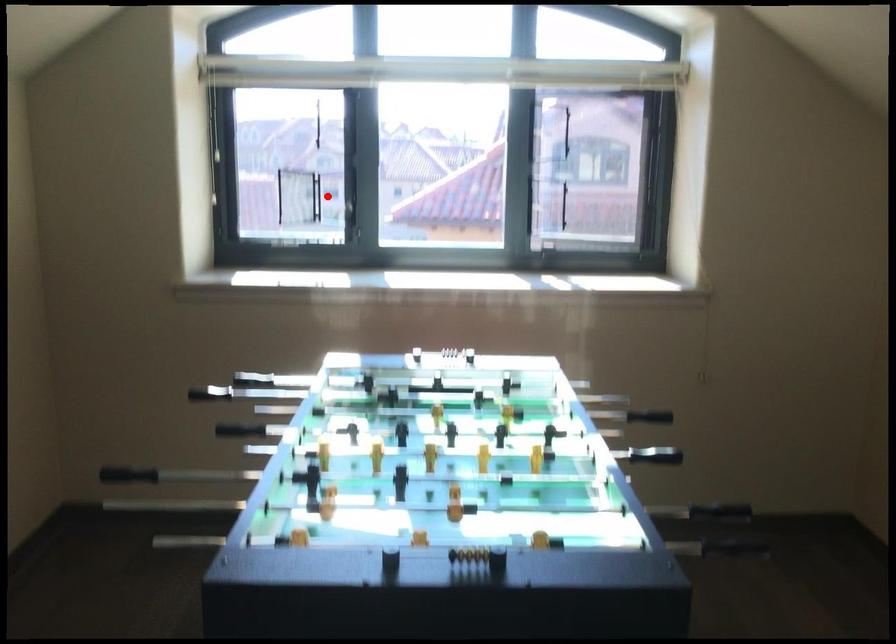
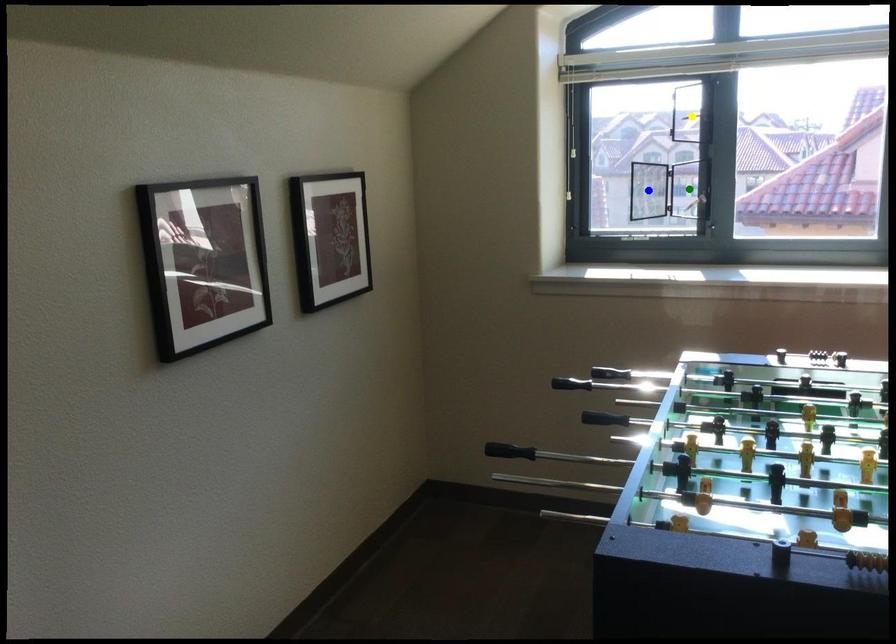
Question: I am providing you with two images of the same scene from different viewpoints. A red point is marked on the first image. You are given multiple points on the second image. Which mark in image 2 goes with the point in image 1?

Choices:
 (A) yellow point
 (B) blue point
 (C) green point

Answer: (C)